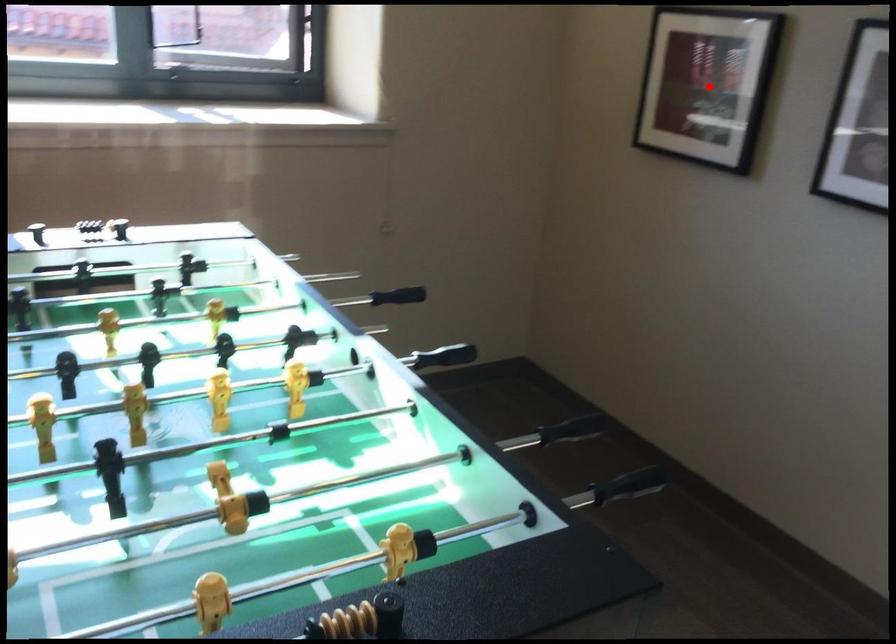
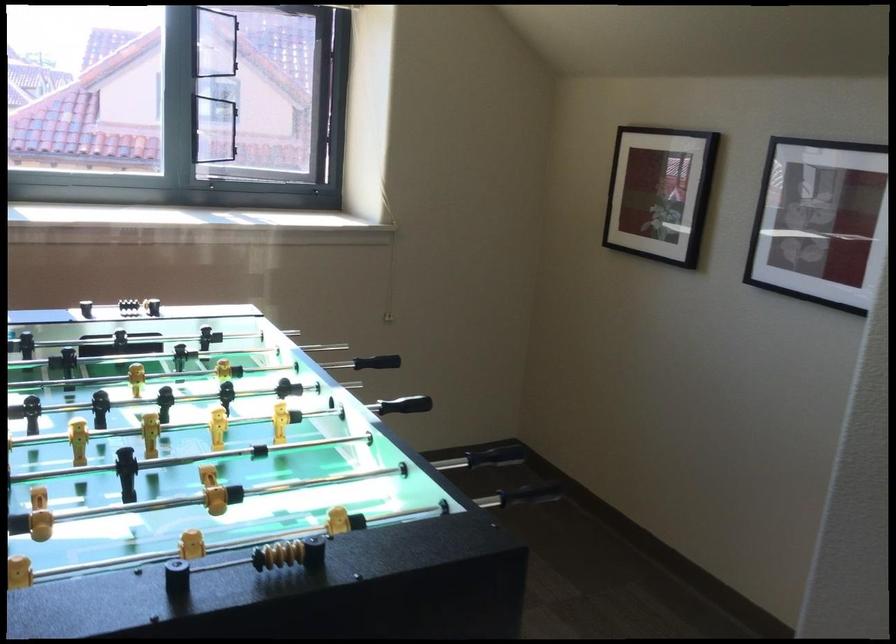
Question: A red point is marked in image1. In image2, is the corresponding 3D point closer to the camera or farther? Reply with the corresponding letter.

Choices:
 (A) The corresponding 3D point is closer.
 (B) The corresponding 3D point is farther.

Answer: (B)